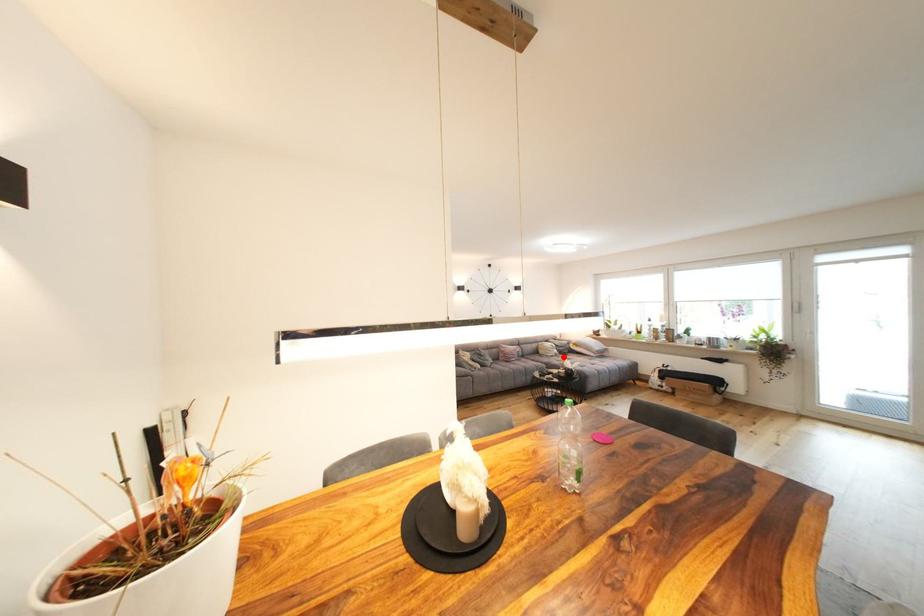
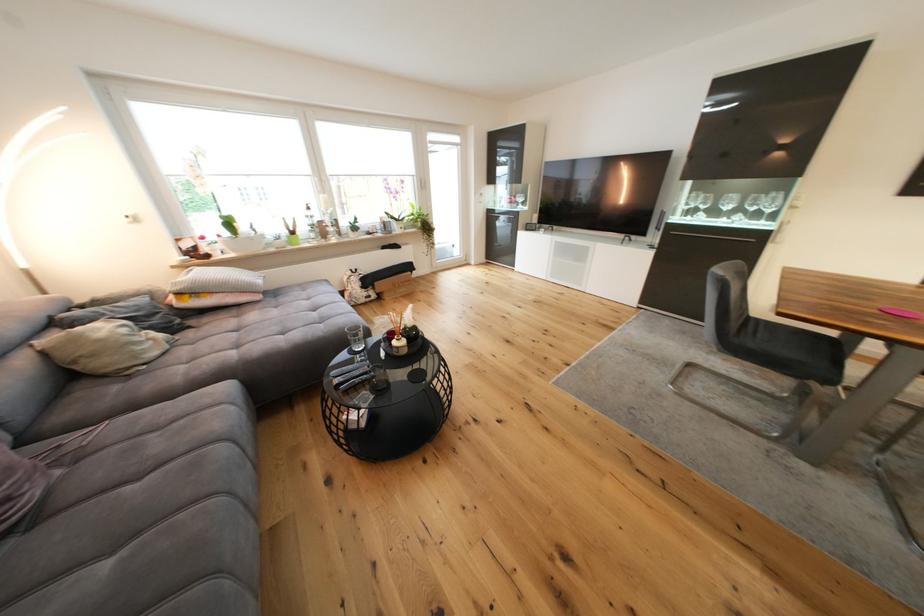
Question: I am providing you with two images of the same scene from different viewpoints. A red point is shown in image1. For the corresponding object point in image2, is it positioned nearer or farther from the camera?

Choices:
 (A) Nearer
 (B) Farther

Answer: (A)